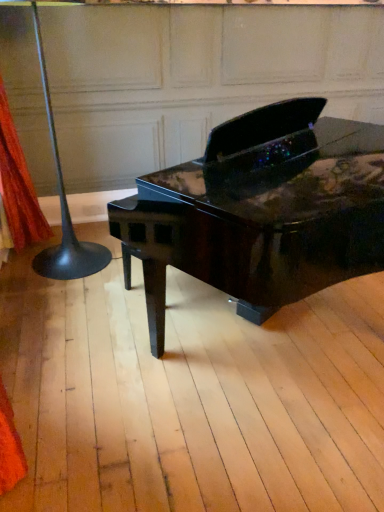
Question: Does glossy black piano at center lie behind orange fabric at left?

Choices:
 (A) no
 (B) yes

Answer: (A)

Question: Is orange fabric at left completely or partially inside glossy black piano at center?

Choices:
 (A) yes
 (B) no

Answer: (B)

Question: Is glossy black piano at center smaller than orange fabric at left?

Choices:
 (A) yes
 (B) no

Answer: (B)

Question: Can you confirm if glossy black piano at center is bigger than orange fabric at left?

Choices:
 (A) yes
 (B) no

Answer: (A)

Question: From a real-world perspective, is glossy black piano at center located beneath orange fabric at left?

Choices:
 (A) yes
 (B) no

Answer: (A)

Question: Is black glossy floor lamp at left situated inside glossy black piano at center or outside?

Choices:
 (A) inside
 (B) outside

Answer: (B)

Question: Is black glossy floor lamp at left taller or shorter than glossy black piano at center?

Choices:
 (A) short
 (B) tall

Answer: (B)

Question: Considering the positions of black glossy floor lamp at left and glossy black piano at center in the image, is black glossy floor lamp at left wider or thinner than glossy black piano at center?

Choices:
 (A) wide
 (B) thin

Answer: (B)

Question: Is point (41, 65) closer or farther from the camera than point (347, 166)?

Choices:
 (A) farther
 (B) closer

Answer: (A)

Question: From the image's perspective, relative to orange fabric at left, is black glossy floor lamp at left above or below?

Choices:
 (A) below
 (B) above

Answer: (A)

Question: Considering the positions of black glossy floor lamp at left and orange fabric at left in the image, is black glossy floor lamp at left wider or thinner than orange fabric at left?

Choices:
 (A) wide
 (B) thin

Answer: (A)

Question: From a real-world perspective, relative to orange fabric at left, is black glossy floor lamp at left vertically above or below?

Choices:
 (A) below
 (B) above

Answer: (A)

Question: Considering the positions of black glossy floor lamp at left and orange fabric at left in the image, is black glossy floor lamp at left taller or shorter than orange fabric at left?

Choices:
 (A) short
 (B) tall

Answer: (B)

Question: Considering the positions of glossy black piano at center and black glossy floor lamp at left in the image, is glossy black piano at center bigger or smaller than black glossy floor lamp at left?

Choices:
 (A) big
 (B) small

Answer: (A)

Question: Looking at their shapes, would you say glossy black piano at center is wider or thinner than black glossy floor lamp at left?

Choices:
 (A) thin
 (B) wide

Answer: (B)